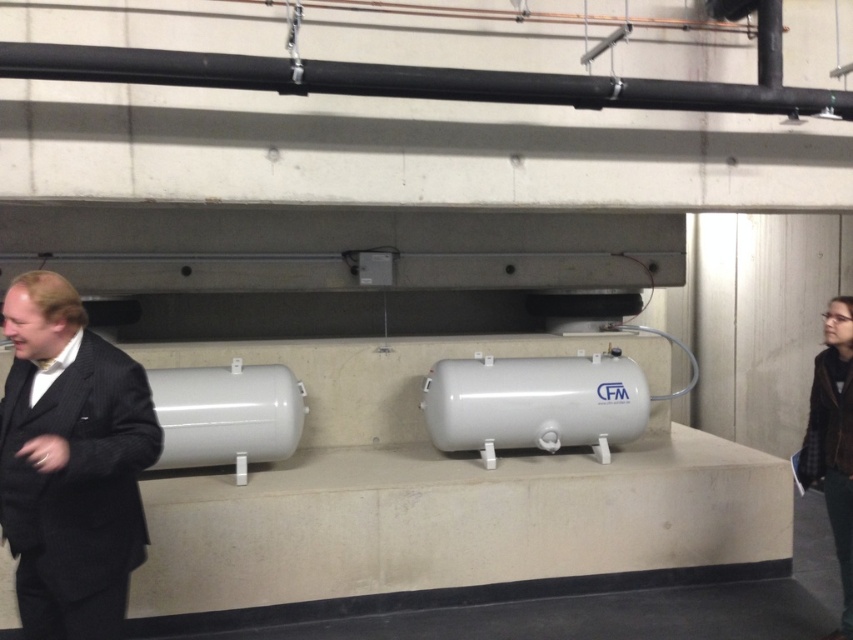
Between point (64, 628) and point (523, 84), which one is positioned behind?

The point (523, 84) is more distant.

Between dark pinstripe suit at left and black matte pipe at upper center, which one has less height?

black matte pipe at upper center is shorter.

Find the location of a particular element. dark pinstripe suit at left is located at coordinates (70, 464).